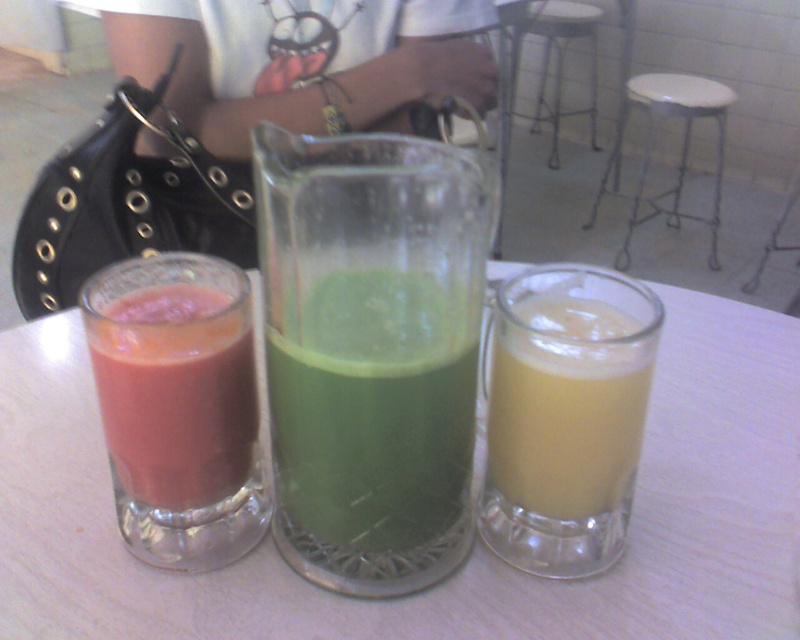
You are a guest at a party and want to grab a drink from the table. You notice the transparent glass at center and the metallic silver stool at upper center. Which object is closer to the ceiling?

The metallic silver stool at upper center is closer to the ceiling because it is taller than the transparent glass at center.

You are standing at the table and want to reach for a glass. There are two points marked on the table surface at coordinates point (666,387) and point (550,115). Which point is closer to you?

Point (666,387) is in front of point (550,115), so it is closer to you.

You are a bartender preparing drinks for a customer. You have a green translucent liquid at center and a matte glass at left. Which container holds a larger volume of liquid?

The green translucent liquid at center is larger in size than matte glass at left, so the container with the green translucent liquid at center holds a larger volume of liquid.